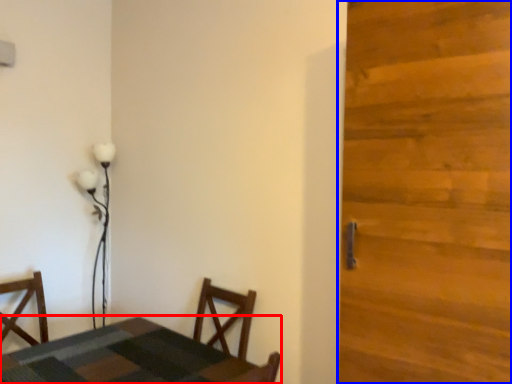
Question: Among these objects, which one is farthest to the camera, table (highlighted by a red box) or door (highlighted by a blue box)?

Choices:
 (A) table
 (B) door

Answer: (A)